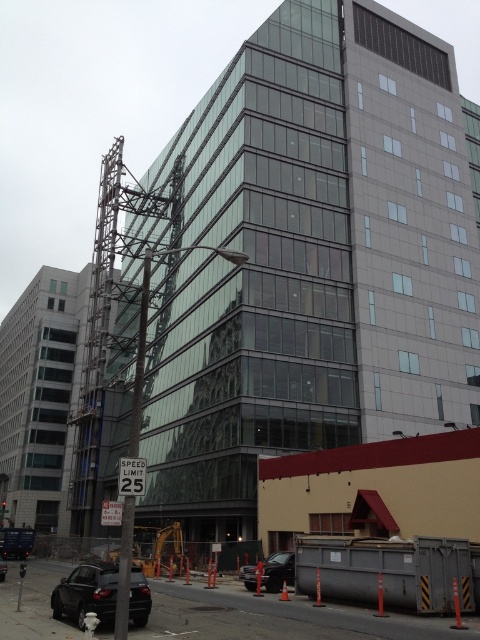
Which of these two, gray concrete construction site at lower center or black matte car at lower left, stands taller?

gray concrete construction site at lower center

Who is positioned more to the right, gray concrete construction site at lower center or black matte car at lower left?

black matte car at lower left

What do you see at coordinates (276, 618) in the screenshot? I see `gray concrete construction site at lower center` at bounding box center [276, 618].

Identify the location of gray concrete construction site at lower center. The height and width of the screenshot is (640, 480). (276, 618).

Who is positioned more to the right, black matte car at lower left or shiny black sedan at lower center?

shiny black sedan at lower center

You are a GUI agent. You are given a task and a screenshot of the screen. Output one action in this format:
    pyautogui.click(x=<x>, y=<y>)
    Task: Click on the black matte car at lower left
    
    Given the screenshot: What is the action you would take?
    pyautogui.click(x=86, y=593)

The height and width of the screenshot is (640, 480). Find the location of `black matte car at lower left`. black matte car at lower left is located at coordinates (86, 593).

Who is more forward, [187,598] or [282,577]?

Point [187,598] is in front.

Who is more forward, (31, 611) or (251, 564)?

Point (31, 611) is in front.

I want to click on gray concrete construction site at lower center, so click(276, 618).